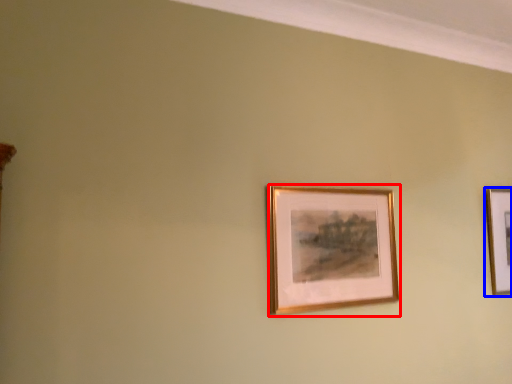
Question: Which object appears closest to the camera in this image, picture frame (highlighted by a red box) or picture frame (highlighted by a blue box)?

Choices:
 (A) picture frame
 (B) picture frame

Answer: (A)